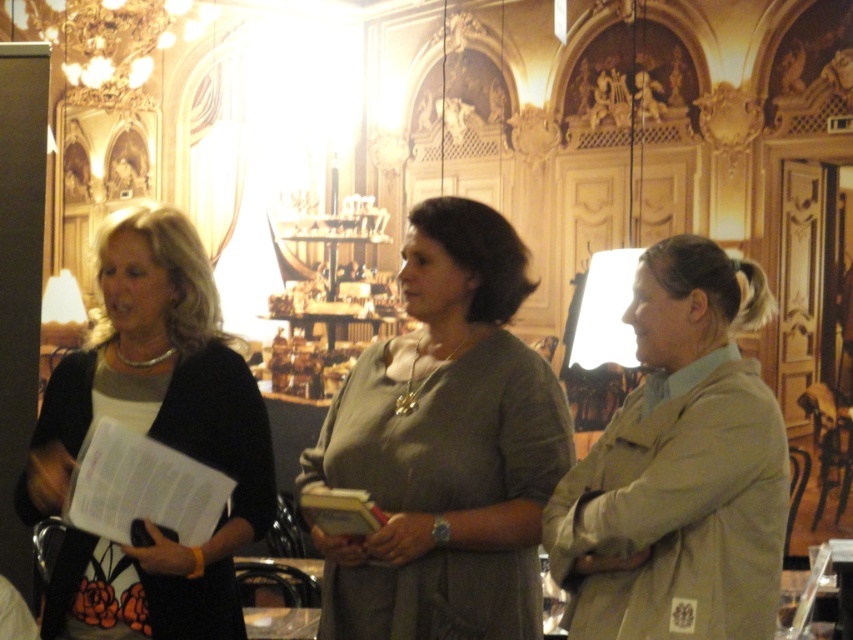
Looking at this image, you are a fashion designer observing the two outfits in the image. Which clothing item, the matte olive green blouse at center or the tan fabric jacket at right, is located to the left of the other?

The matte olive green blouse at center is positioned to the left of the tan fabric jacket at right.

You are a fashion designer observing the two women in the image. The first woman wears a matte black sweater at left, and the second wears a matte olive green blouse at center. Which woman is standing to the right of the other?

The matte olive green blouse at center is positioned on the right side of the matte black sweater at left, so the woman wearing the matte olive green blouse at center is standing to the right of the woman in the matte black sweater at left.